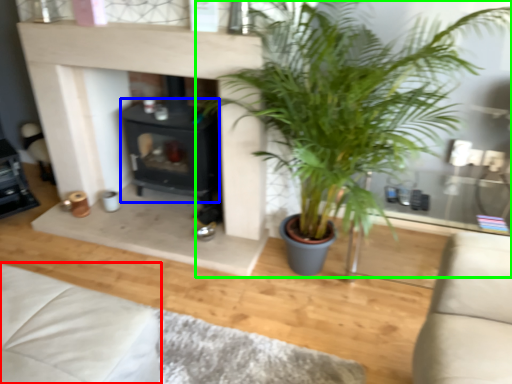
Question: Which is farther away from couch (highlighted by a red box)? fireplace (highlighted by a blue box) or houseplant (highlighted by a green box)?

Choices:
 (A) fireplace
 (B) houseplant

Answer: (A)